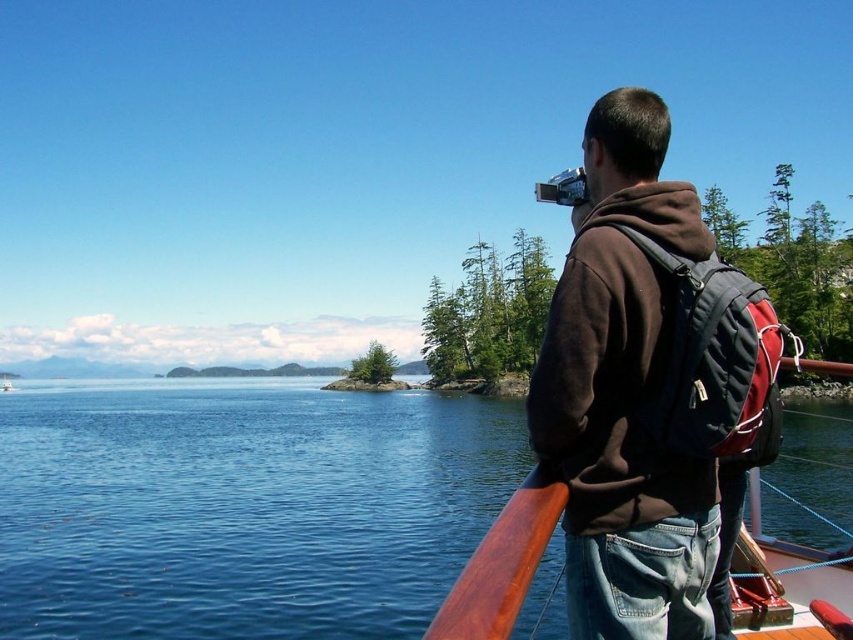
You are on a boat and want to take a photo of the blue water at center. Where exactly should you point your camera?

You should point your camera at point 0.792 on the x axis and 0.284 on the y axis to capture the blue water at center.

You are a photographer on a boat and want to capture the blue water at center and the brown matte hoodie at upper right in your shot. Which object appears taller in the photo?

The blue water at center appears taller in the photo because it has a greater height compared to the brown matte hoodie at upper right.

You are on a boat and want to take a photo of the blue water at center and the brown matte hoodie at upper right. Which one should you focus on first if you want to capture both in a single frame?

The blue water at center is bigger than the brown matte hoodie at upper right, so you should focus on the blue water at center first to ensure it is in sharp focus before adjusting for the smaller object.